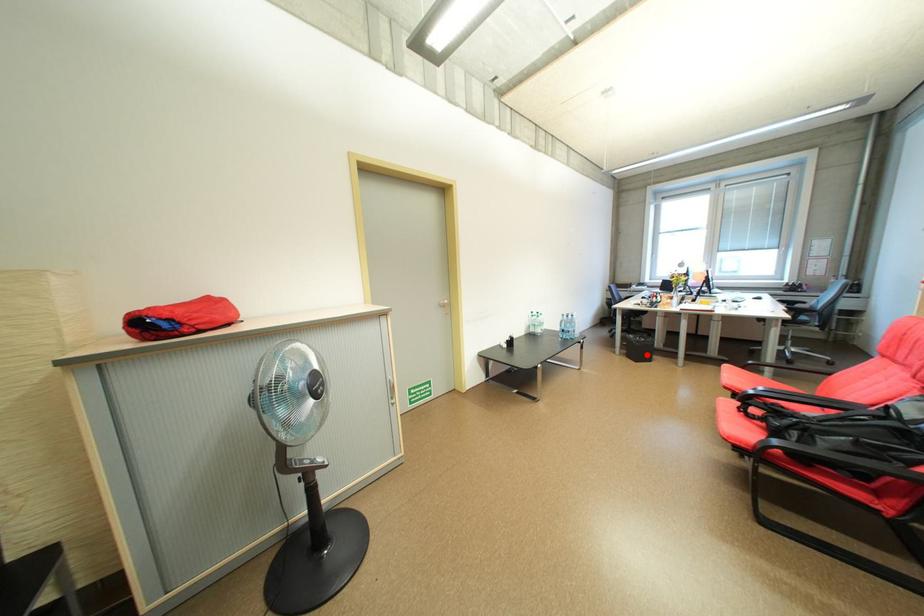
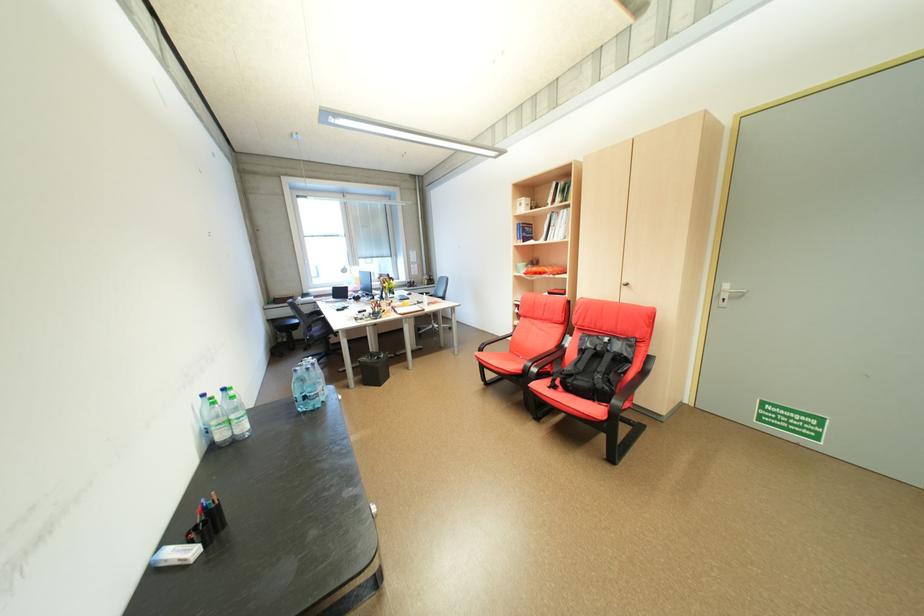
The point at the highlighted location is marked in the first image. Where is the corresponding point in the second image?

(382, 377)